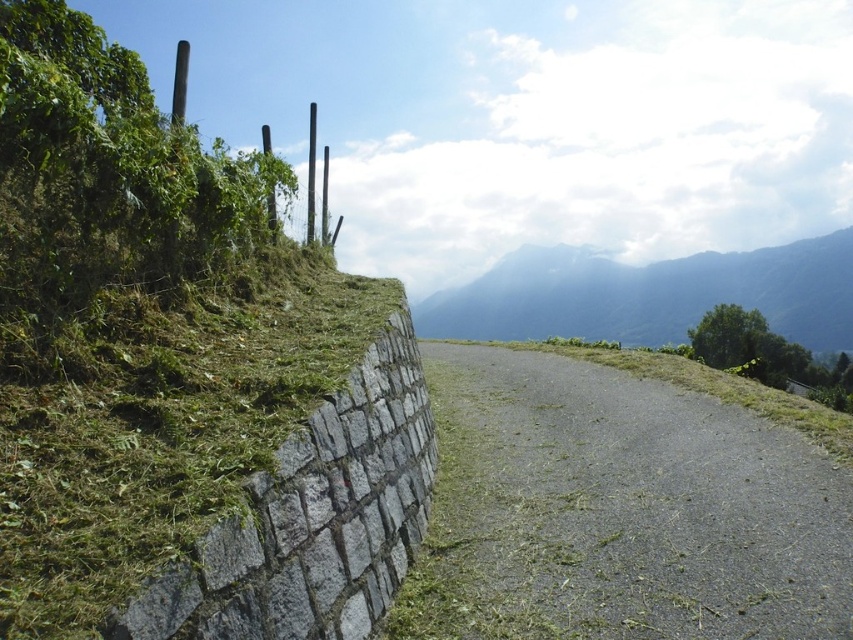
You are a hiker standing on the gray asphalt road at center. You look towards the green textured mountain at upper center. Which object is taller from your perspective?

The green textured mountain at upper center is taller than the gray asphalt road at center.

You are standing at the starting point of the pathway in the image. You see two points marked on the path ahead of you. The first point is at coordinates point [476,369] and the second is at point [524,314]. Which point is closer to you as you walk along the path?

Point [476,369] is in front of point [524,314], so the first point is closer to you as you walk along the path.

You are a hiker standing on the gray asphalt road at center and want to reach the smooth gray pole at upper center. Which direction should you move to get closer to the pole?

The gray asphalt road at center is below the smooth gray pole at upper center, so you should move upward along the gray asphalt road at center to get closer to the pole.